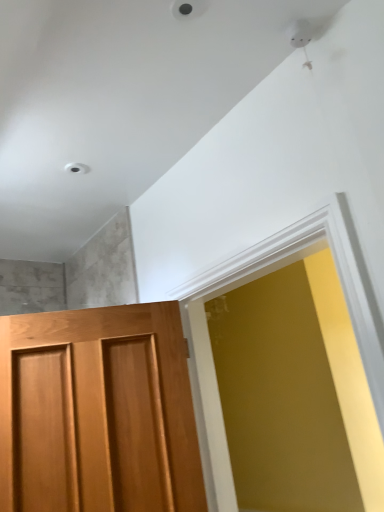
Measure the distance between wooden door at left and camera.

4.40 feet.

This screenshot has height=512, width=384. What do you see at coordinates (97, 412) in the screenshot?
I see `wooden door at left` at bounding box center [97, 412].

This screenshot has height=512, width=384. In order to click on wooden door at left in this screenshot , I will do `click(97, 412)`.

You are a GUI agent. You are given a task and a screenshot of the screen. Output one action in this format:
    pyautogui.click(x=<x>, y=<y>)
    Task: Click on the matte white frame at center
    
    Given the screenshot: What is the action you would take?
    pyautogui.click(x=254, y=279)

The width and height of the screenshot is (384, 512). Describe the element at coordinates (254, 279) in the screenshot. I see `matte white frame at center` at that location.

The height and width of the screenshot is (512, 384). I want to click on wooden door at left, so click(97, 412).

Based on the photo, can you confirm if wooden door at left is positioned to the right of matte white frame at center?

No, wooden door at left is not to the right of matte white frame at center.

Considering the positions of objects wooden door at left and matte white frame at center in the image provided, who is in front, wooden door at left or matte white frame at center?

Positioned in front is matte white frame at center.

Between point (20, 415) and point (202, 280), which one is positioned behind?

The point (202, 280) is farther.

From the image's perspective, is wooden door at left beneath matte white frame at center?

Yes.

From a real-world perspective, which is physically below, wooden door at left or matte white frame at center?

wooden door at left, from a real-world perspective.

Which of these two, wooden door at left or matte white frame at center, is wider?

Wider between the two is matte white frame at center.

From their relative heights in the image, would you say wooden door at left is taller or shorter than matte white frame at center?

In the image, wooden door at left appears to be shorter than matte white frame at center.

Who is bigger, wooden door at left or matte white frame at center?

Bigger between the two is matte white frame at center.

From the picture: Which is correct: wooden door at left is inside matte white frame at center, or outside of it?

wooden door at left is outside matte white frame at center.

Would you consider wooden door at left to be distant from matte white frame at center?

wooden door at left is near matte white frame at center, not far away.

Based on the photo, could you tell me if wooden door at left is facing matte white frame at center?

No, wooden door at left is not facing towards matte white frame at center.

Can you tell me how much wooden door at left and matte white frame at center differ in facing direction?

The angular difference between wooden door at left and matte white frame at center is 68.5 degrees.

At what (x,y) coordinates should I click in order to perform the action: click on window above the wooden door at left (from the image's perspective). Please return your answer as a coordinate pair (x, y). Looking at the image, I should click on (254, 279).

Is matte white frame at center to the left of wooden door at left from the viewer's perspective?

In fact, matte white frame at center is to the right of wooden door at left.

Between matte white frame at center and wooden door at left, which one is positioned behind?

wooden door at left.

Considering the points (352, 236) and (108, 412), which point is behind, point (352, 236) or point (108, 412)?

The point (108, 412) is farther.

From the picture: From the image's perspective, which is below, matte white frame at center or wooden door at left?

wooden door at left.

From a real-world perspective, is matte white frame at center physically below wooden door at left?

Actually, matte white frame at center is physically above wooden door at left in the real world.

Does matte white frame at center have a lesser width compared to wooden door at left?

No.

From the picture: Can you confirm if matte white frame at center is taller than wooden door at left?

Yes, matte white frame at center is taller than wooden door at left.

Can you confirm if matte white frame at center is smaller than wooden door at left?

No, matte white frame at center is not smaller than wooden door at left.

Is matte white frame at center not inside wooden door at left?

Indeed, matte white frame at center is completely outside wooden door at left.

Is matte white frame at center touching wooden door at left?

matte white frame at center and wooden door at left are clearly separated.

Is matte white frame at center positioned with its back to wooden door at left?

No.

Where is `door that appears behind the matte white frame at center`? The image size is (384, 512). door that appears behind the matte white frame at center is located at coordinates (97, 412).

The height and width of the screenshot is (512, 384). What are the coordinates of `window that is above the wooden door at left (from a real-world perspective)` in the screenshot? It's located at (254, 279).

The height and width of the screenshot is (512, 384). I want to click on door behind the matte white frame at center, so click(97, 412).